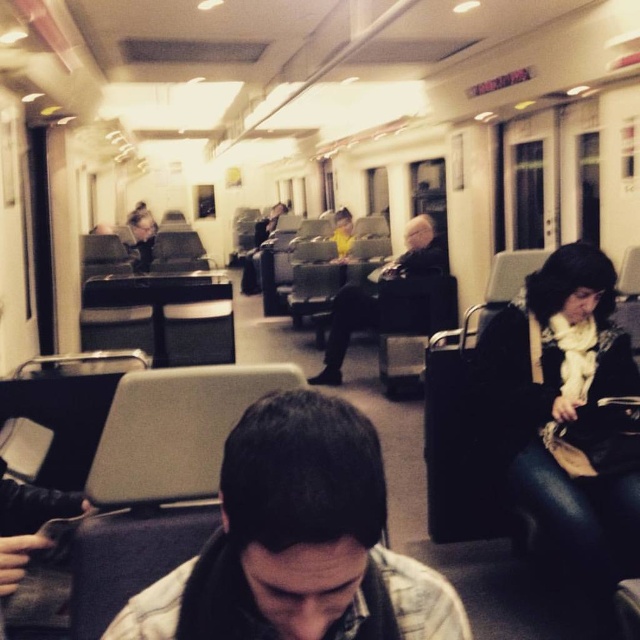
Does plaid shirt at center have a smaller size compared to black leather jacket at right?

Correct, plaid shirt at center occupies less space than black leather jacket at right.

Between plaid shirt at center and black leather jacket at right, which one has less height?

plaid shirt at center

The image size is (640, 640). Describe the element at coordinates (298, 541) in the screenshot. I see `plaid shirt at center` at that location.

Locate an element on the screen. The image size is (640, 640). plaid shirt at center is located at coordinates point(298,541).

Which is more to the right, dark gray fabric jacket at center or matte black jacket at center?

Positioned to the right is dark gray fabric jacket at center.

Which is more to the left, dark gray fabric jacket at center or matte black jacket at center?

matte black jacket at center

Based on the photo, measure the distance between dark gray fabric jacket at center and camera.

They are 5.34 meters apart.

This screenshot has height=640, width=640. Find the location of `dark gray fabric jacket at center`. dark gray fabric jacket at center is located at coordinates (346, 330).

Between black leather jacket at right and dark gray fabric jacket at center, which one appears on the left side from the viewer's perspective?

Positioned to the left is dark gray fabric jacket at center.

Does black leather jacket at right have a smaller size compared to dark gray fabric jacket at center?

Indeed, black leather jacket at right has a smaller size compared to dark gray fabric jacket at center.

This screenshot has width=640, height=640. What do you see at coordinates (564, 417) in the screenshot?
I see `black leather jacket at right` at bounding box center [564, 417].

Where is `black leather jacket at right`? black leather jacket at right is located at coordinates (564, 417).